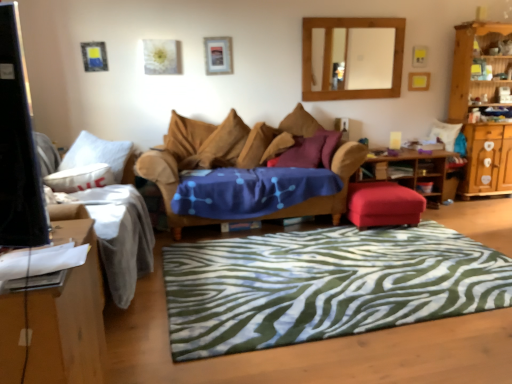
Locate an element on the screen. The width and height of the screenshot is (512, 384). free location above wooden framed mirror at upper center (from a real-world perspective) is located at coordinates (357, 14).